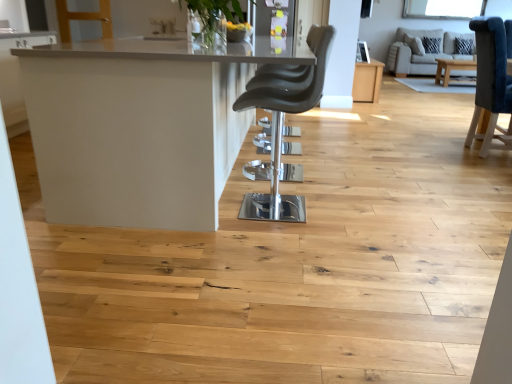
Question: Is white glossy table at center, the 2th table viewed from the top, taller or shorter than beige fabric couch at upper right?

Choices:
 (A) short
 (B) tall

Answer: (A)

Question: From the image's perspective, relative to beige fabric couch at upper right, is white glossy table at center, positioned as the 1th table in front-to-back order, above or below?

Choices:
 (A) above
 (B) below

Answer: (B)

Question: Which object is the farthest from the light brown wood table at center, marked as the 2th table in a front-to-back arrangement?

Choices:
 (A) beige fabric couch at upper right
 (B) white glossy table at center, the 2th table viewed from the top
 (C) matte black chair at center
 (D) clear glass window screen at upper center

Answer: (B)

Question: Which of these objects is positioned closest to the matte black chair at center?

Choices:
 (A) light brown wood table at center, positioned as the second table in bottom-to-top order
 (B) white glossy table at center, the 1th table in the bottom-to-top sequence
 (C) beige fabric couch at upper right
 (D) clear glass window screen at upper center

Answer: (B)